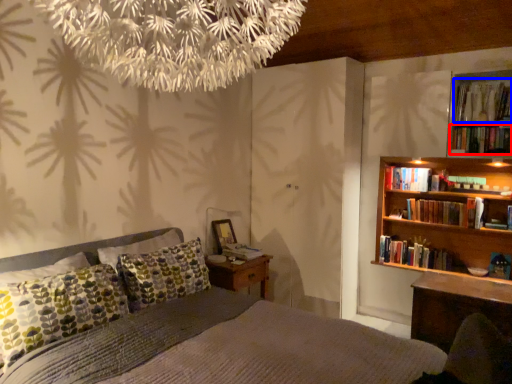
Question: Among these objects, which one is farthest to the camera, book (highlighted by a red box) or book (highlighted by a blue box)?

Choices:
 (A) book
 (B) book

Answer: (B)